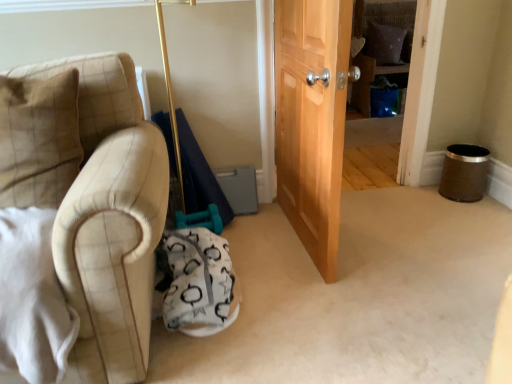
Question: Is the surface of white fabric swivel chair at lower center in direct contact with brown fabric pillow at upper center, placed as the first pillow when sorted from right to left?

Choices:
 (A) no
 (B) yes

Answer: (A)

Question: From a real-world perspective, is white fabric swivel chair at lower center on brown fabric pillow at upper center, the second pillow from the bottom?

Choices:
 (A) yes
 (B) no

Answer: (B)

Question: Is white fabric swivel chair at lower center at the left side of brown fabric pillow at upper center, the second pillow from the bottom?

Choices:
 (A) no
 (B) yes

Answer: (B)

Question: Is white fabric swivel chair at lower center thinner than brown fabric pillow at upper center, which is counted as the first pillow, starting from the back?

Choices:
 (A) yes
 (B) no

Answer: (B)

Question: Can you confirm if white fabric swivel chair at lower center is bigger than brown fabric pillow at upper center, which ranks as the second pillow in left-to-right order?

Choices:
 (A) yes
 (B) no

Answer: (A)

Question: Can you confirm if white fabric swivel chair at lower center is smaller than brown fabric pillow at upper center, placed as the first pillow when sorted from right to left?

Choices:
 (A) no
 (B) yes

Answer: (A)

Question: Considering the relative sizes of beige plaid pillow at left, arranged as the second pillow when viewed from the right, and white fabric swivel chair at lower center in the image provided, is beige plaid pillow at left, arranged as the second pillow when viewed from the right, taller than white fabric swivel chair at lower center?

Choices:
 (A) yes
 (B) no

Answer: (A)

Question: Is beige plaid pillow at left, which is counted as the 1th pillow, starting from the bottom, not inside white fabric swivel chair at lower center?

Choices:
 (A) yes
 (B) no

Answer: (A)

Question: Does beige plaid pillow at left, placed as the second pillow when sorted from top to bottom, have a lesser width compared to white fabric swivel chair at lower center?

Choices:
 (A) no
 (B) yes

Answer: (B)

Question: Can you confirm if beige plaid pillow at left, the first pillow viewed from the front, is shorter than white fabric swivel chair at lower center?

Choices:
 (A) no
 (B) yes

Answer: (A)

Question: Considering the relative positions of beige plaid pillow at left, the first pillow viewed from the front, and white fabric swivel chair at lower center in the image provided, is beige plaid pillow at left, the first pillow viewed from the front, in front of white fabric swivel chair at lower center?

Choices:
 (A) no
 (B) yes

Answer: (B)

Question: Is beige plaid pillow at left, the 1th pillow when ordered from left to right, at the left side of white fabric swivel chair at lower center?

Choices:
 (A) no
 (B) yes

Answer: (B)

Question: Can you confirm if brown fabric pillow at upper center, the first pillow positioned from the top, is shorter than white fabric swivel chair at lower center?

Choices:
 (A) yes
 (B) no

Answer: (B)